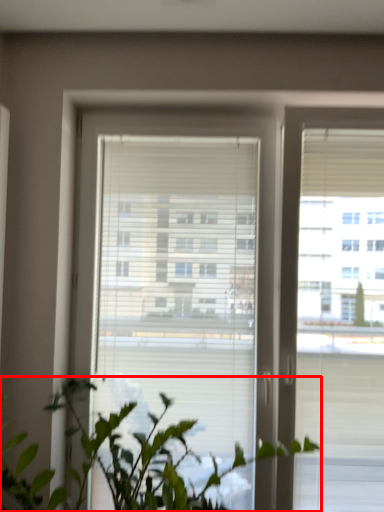
Question: From the image, what is the correct spatial relationship of houseplant (annotated by the red box) in relation to window?

Choices:
 (A) left
 (B) right

Answer: (A)